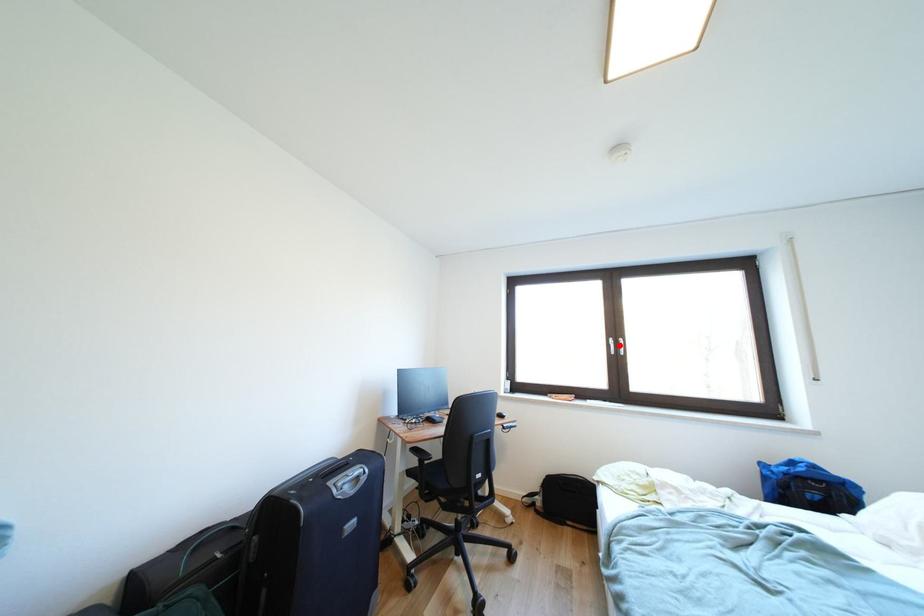
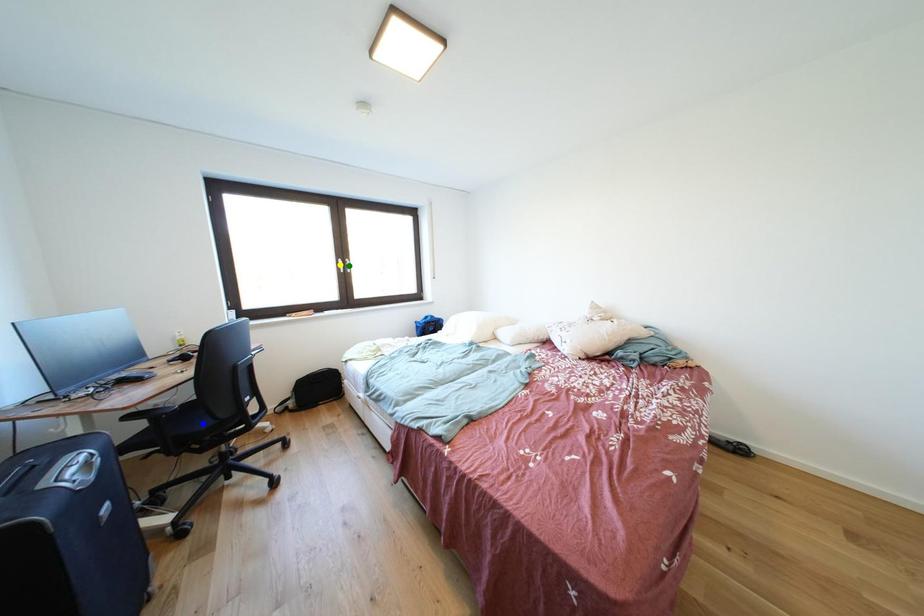
Question: I am providing you with two images of the same scene from different viewpoints. A red point is marked on the first image. You are given multiple points on the second image. Which spot in image 2 lines up with the point in image 1?

Choices:
 (A) blue point
 (B) yellow point
 (C) green point

Answer: (C)